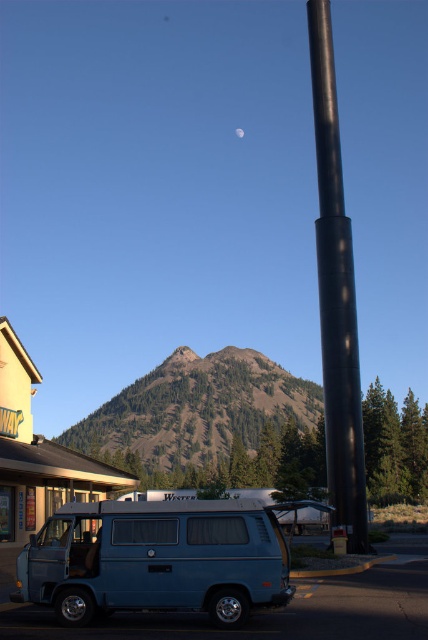
Question: Is green textured mountain at center smaller than black matte pole at center?

Choices:
 (A) no
 (B) yes

Answer: (A)

Question: Is blue matte van at lower left above black matte pole at center?

Choices:
 (A) no
 (B) yes

Answer: (A)

Question: Does blue matte van at lower left appear on the right side of silvery reflective moon at upper center?

Choices:
 (A) no
 (B) yes

Answer: (A)

Question: Which point is farther from the camera taking this photo?

Choices:
 (A) (256, 506)
 (B) (240, 134)
 (C) (341, 301)

Answer: (B)

Question: Which point is closer to the camera?

Choices:
 (A) (240, 132)
 (B) (267, 568)
 (C) (279, 394)

Answer: (B)

Question: Which point is closer to the camera?

Choices:
 (A) silvery reflective moon at upper center
 (B) green textured mountain at center
 (C) blue matte van at lower left

Answer: (C)